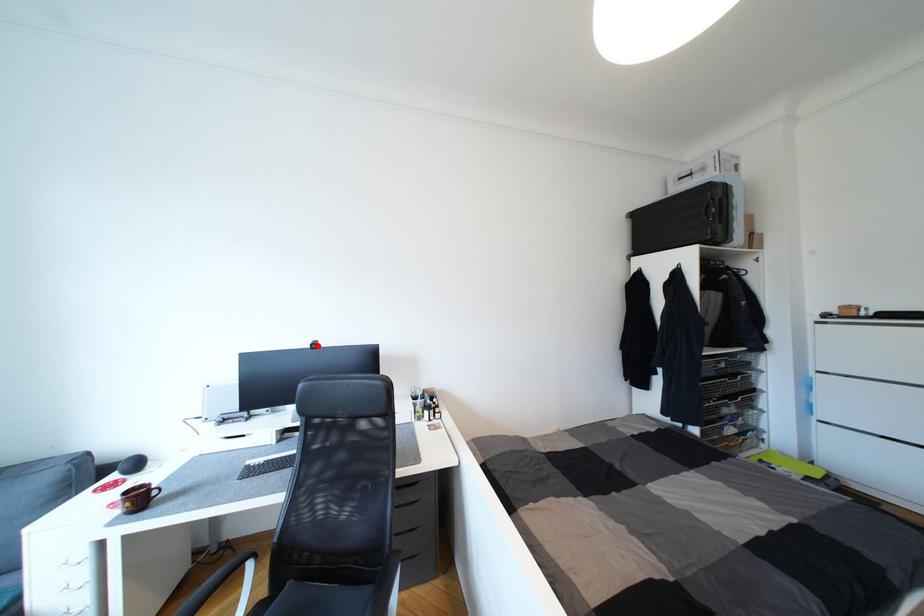
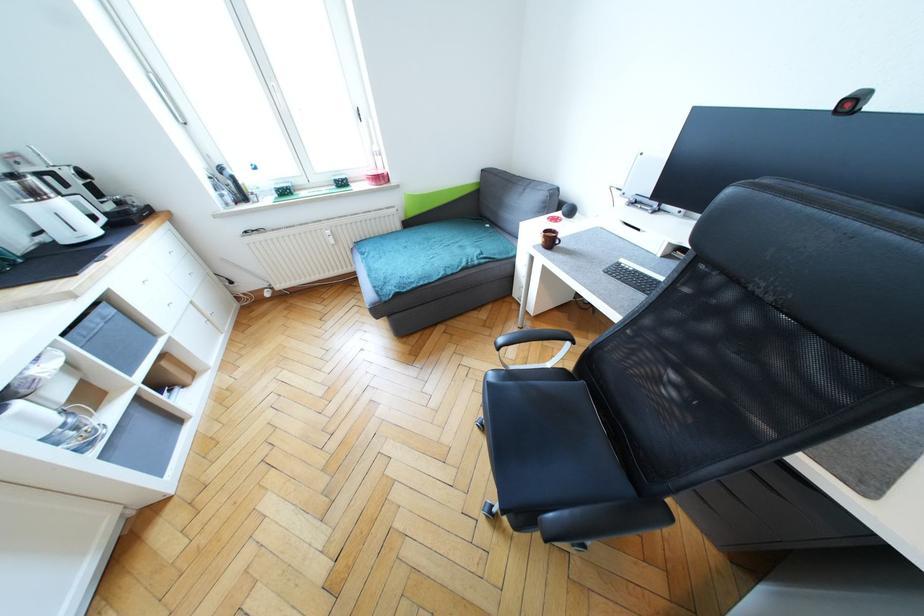
Question: I am providing you with two images of the same scene from different viewpoints. A red point is marked on the first image. Is the red point's position out of view in image 2?

Choices:
 (A) Yes
 (B) No

Answer: (B)